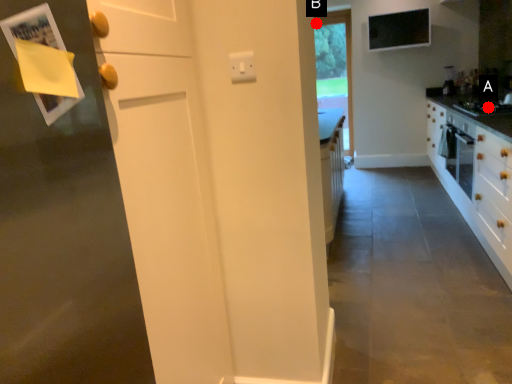
Question: Two points are circled on the image, labeled by A and B beside each circle. Which point is closer to the camera?

Choices:
 (A) A is closer
 (B) B is closer

Answer: (A)